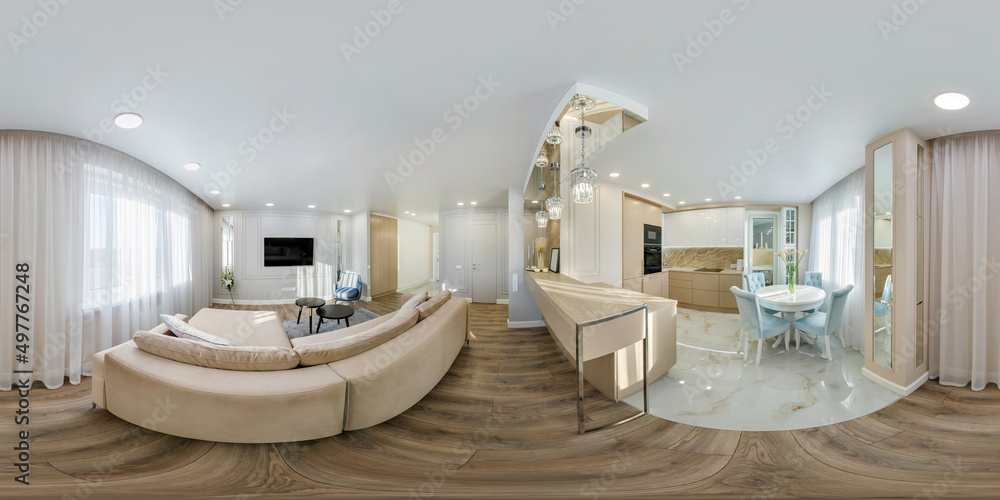
The image size is (1000, 500). I want to click on couch cushion, so click(x=257, y=360), click(x=335, y=341), click(x=433, y=308), click(x=418, y=301), click(x=183, y=332).